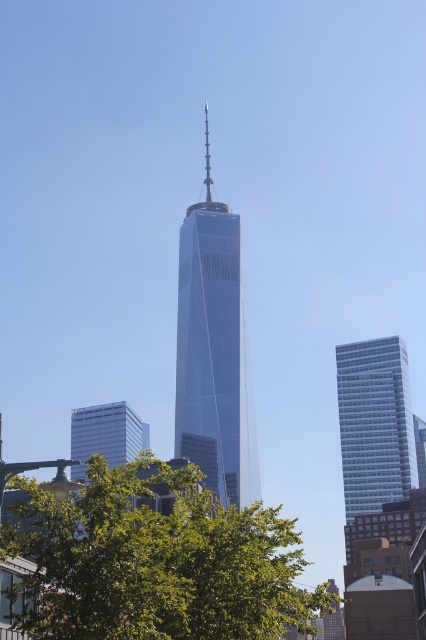
Question: Among these points, which one is nearest to the camera?

Choices:
 (A) (230, 374)
 (B) (357, 451)

Answer: (A)

Question: Can you confirm if green leafy tree at center is positioned to the right of glassy steel skyscraper at center?

Choices:
 (A) no
 (B) yes

Answer: (A)

Question: Which object is closer to the camera taking this photo?

Choices:
 (A) white glass building at right
 (B) green leafy tree at center

Answer: (B)

Question: Among these objects, which one is farthest from the camera?

Choices:
 (A) glassy steel skyscraper at center
 (B) white glass building at right

Answer: (B)

Question: Can you confirm if green leafy tree at center is positioned above glassy steel skyscraper at center?

Choices:
 (A) no
 (B) yes

Answer: (A)

Question: Is green leafy tree at center smaller than glassy steel skyscraper at center?

Choices:
 (A) no
 (B) yes

Answer: (A)